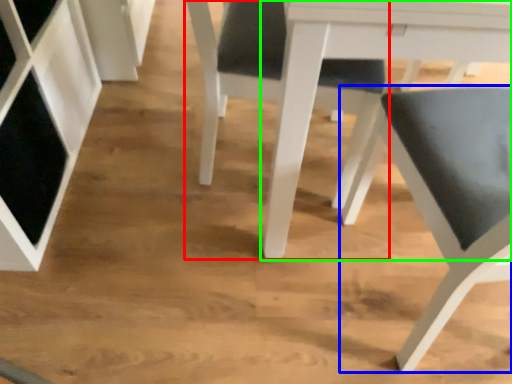
Question: Estimate the real-world distances between objects in this image. Which object is closer to chair (highlighted by a red box), chair (highlighted by a blue box) or table (highlighted by a green box)?

Choices:
 (A) chair
 (B) table

Answer: (B)